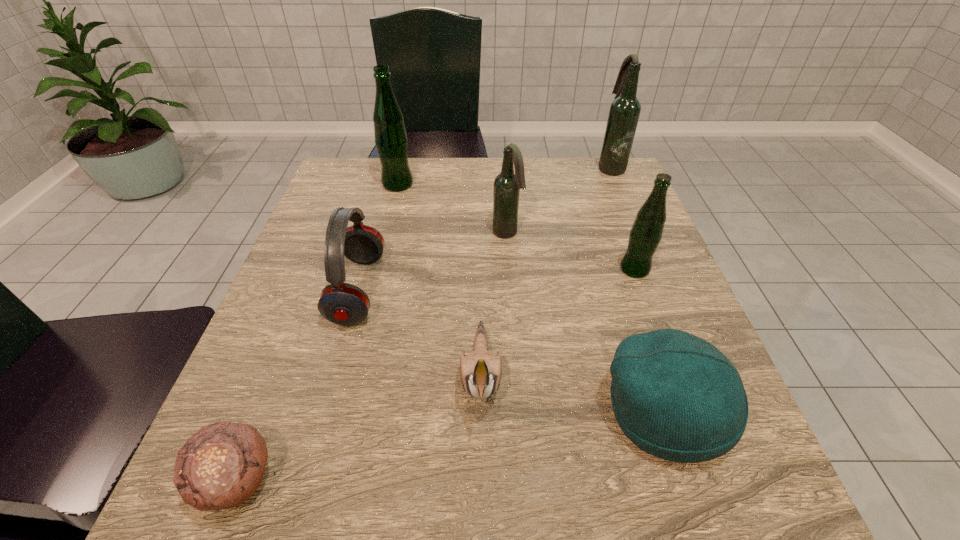
The image size is (960, 540). I want to click on beanie, so click(674, 395).

Identify the location of the shortest object. The height and width of the screenshot is (540, 960). (221, 466).

Locate an element on the screen. The width and height of the screenshot is (960, 540). vacant space located 0.050m on the front of the farther dark beer bottle is located at coordinates (619, 187).

Locate an element on the screen. vacant area situated on the front of the left green beer bottle is located at coordinates (373, 282).

Identify the location of vacant space located on the front of the left dark beer bottle. (513, 311).

This screenshot has width=960, height=540. I want to click on blank area located on the back of the smaller green beer bottle, so click(601, 179).

Locate an element on the screen. Image resolution: width=960 pixels, height=540 pixels. free space located on the ear cups of the red earphone is located at coordinates (460, 289).

Locate an element on the screen. free point located 0.060m at the face of the bird is located at coordinates (481, 481).

The width and height of the screenshot is (960, 540). I want to click on free space located on the left of the beanie, so click(456, 411).

You are a GUI agent. You are given a task and a screenshot of the screen. Output one action in this format:
    pyautogui.click(x=<x>, y=<y>)
    Task: Click on the vacant space located on the back of the muffin
    
    Given the screenshot: What is the action you would take?
    pyautogui.click(x=315, y=280)